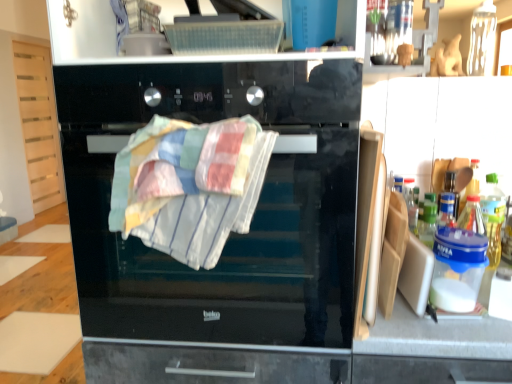
In order to face multicolored woven towel at center, should I rotate leftwards or rightwards?

Turn left by 8.539 degrees to look at multicolored woven towel at center.

In order to click on translucent plastic bottle at right in this screenshot , I will do `click(493, 217)`.

Locate an element on the screen. multicolored woven towel at center is located at coordinates (190, 185).

Which is more to the left, multicolored woven towel at center or black glass oven at center?

From the viewer's perspective, multicolored woven towel at center appears more on the left side.

Which is further, (148, 135) or (105, 68)?

The point (105, 68) is farther from the camera.

From the image's perspective, which is below, multicolored woven towel at center or black glass oven at center?

From the image's view, multicolored woven towel at center is below.

Considering the positions of objects multicolored woven towel at center and black glass oven at center in the image provided, who is in front, multicolored woven towel at center or black glass oven at center?

multicolored woven towel at center is closer to the camera.

In order to click on beach towel above the translucent plastic bottle at right (from the image's perspective) in this screenshot , I will do [x=190, y=185].

Is translucent plastic bottle at right taller than multicolored woven towel at center?

Incorrect, the height of translucent plastic bottle at right is not larger of that of multicolored woven towel at center.

Is translucent plastic bottle at right situated inside multicolored woven towel at center or outside?

The correct answer is: outside.

Does translucent plastic bottle at right lie behind black glass oven at center?

Yes.

Which of these two, translucent plastic bottle at right or black glass oven at center, stands taller?

black glass oven at center is taller.

Is translucent plastic bottle at right positioned beyond the bounds of black glass oven at center?

translucent plastic bottle at right is positioned outside black glass oven at center.

Can you confirm if translucent plastic bottle at right is thinner than black glass oven at center?

Yes, translucent plastic bottle at right is thinner than black glass oven at center.

Is black glass oven at center situated inside multicolored woven towel at center or outside?

black glass oven at center lies outside multicolored woven towel at center.

This screenshot has width=512, height=384. Find the location of `oven that appears on the right of multicolored woven towel at center`. oven that appears on the right of multicolored woven towel at center is located at coordinates (231, 233).

Considering the relative positions of multicolored woven towel at center and translucent plastic bottle at right in the image provided, is multicolored woven towel at center to the right of translucent plastic bottle at right from the viewer's perspective?

No, multicolored woven towel at center is not to the right of translucent plastic bottle at right.

From the image's perspective, does multicolored woven towel at center appear lower than translucent plastic bottle at right?

No, from the image's perspective, multicolored woven towel at center is not beneath translucent plastic bottle at right.

This screenshot has width=512, height=384. What are the coordinates of `beach towel that is on the left side of translucent plastic bottle at right` in the screenshot? It's located at (190, 185).

Measure the distance between black glass oven at center and translucent plastic bottle at right.

They are 30.03 inches apart.

The width and height of the screenshot is (512, 384). Find the location of `oven located above the translucent plastic bottle at right (from a real-world perspective)`. oven located above the translucent plastic bottle at right (from a real-world perspective) is located at coordinates (231, 233).

From the image's perspective, between black glass oven at center and translucent plastic bottle at right, who is located below?

translucent plastic bottle at right, from the image's perspective.

Is black glass oven at center not close to translucent plastic bottle at right?

That's not correct — black glass oven at center is a little close to translucent plastic bottle at right.

Find the location of a particular element. This screenshot has height=384, width=512. beach towel that is on the left side of black glass oven at center is located at coordinates (190, 185).

Image resolution: width=512 pixels, height=384 pixels. Find the location of `bottle on the right of multicolored woven towel at center`. bottle on the right of multicolored woven towel at center is located at coordinates (493, 217).

Which object lies further to the anchor point translucent plastic bottle at right, multicolored woven towel at center or black glass oven at center?

multicolored woven towel at center lies further to translucent plastic bottle at right than the other object.

Looking at the image, which one is located closer to black glass oven at center, multicolored woven towel at center or translucent plastic bottle at right?

multicolored woven towel at center is positioned closer to the anchor black glass oven at center.

Based on their spatial positions, is black glass oven at center or translucent plastic bottle at right closer to multicolored woven towel at center?

black glass oven at center lies closer to multicolored woven towel at center than the other object.

Considering their positions, is black glass oven at center positioned further to translucent plastic bottle at right than multicolored woven towel at center?

The object further to translucent plastic bottle at right is multicolored woven towel at center.

Looking at the image, which one is located closer to multicolored woven towel at center, translucent plastic bottle at right or black glass oven at center?

black glass oven at center.

Based on their spatial positions, is translucent plastic bottle at right or multicolored woven towel at center closer to black glass oven at center?

The object closer to black glass oven at center is multicolored woven towel at center.

Identify the location of oven between multicolored woven towel at center and translucent plastic bottle at right from left to right. The width and height of the screenshot is (512, 384). (231, 233).